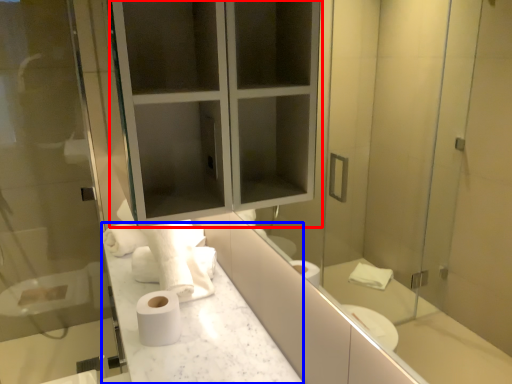
Question: Among these objects, which one is farthest to the camera, medicine cabinet (highlighted by a red box) or counter top (highlighted by a blue box)?

Choices:
 (A) medicine cabinet
 (B) counter top

Answer: (B)